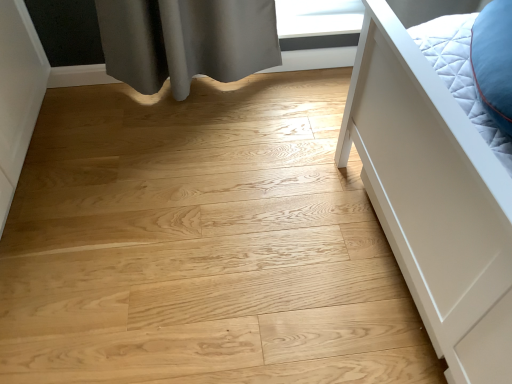
What is the approximate height of natural wood screen door at lower left?

It is 21.63 inches.

Describe the element at coordinates (18, 94) in the screenshot. The image size is (512, 384). I see `natural wood screen door at lower left` at that location.

Measure the distance between natural wood screen door at lower left and camera.

natural wood screen door at lower left and camera are 4.58 feet apart from each other.

Identify the location of natural wood screen door at lower left. (18, 94).

In order to click on natural wood screen door at lower left in this screenshot , I will do `click(18, 94)`.